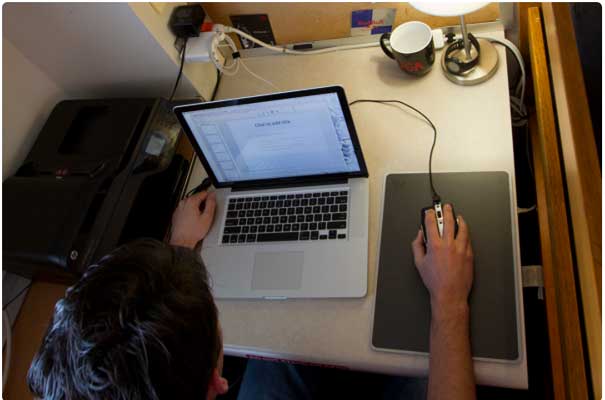
Where is `white power cord`? white power cord is located at coordinates (345, 46).